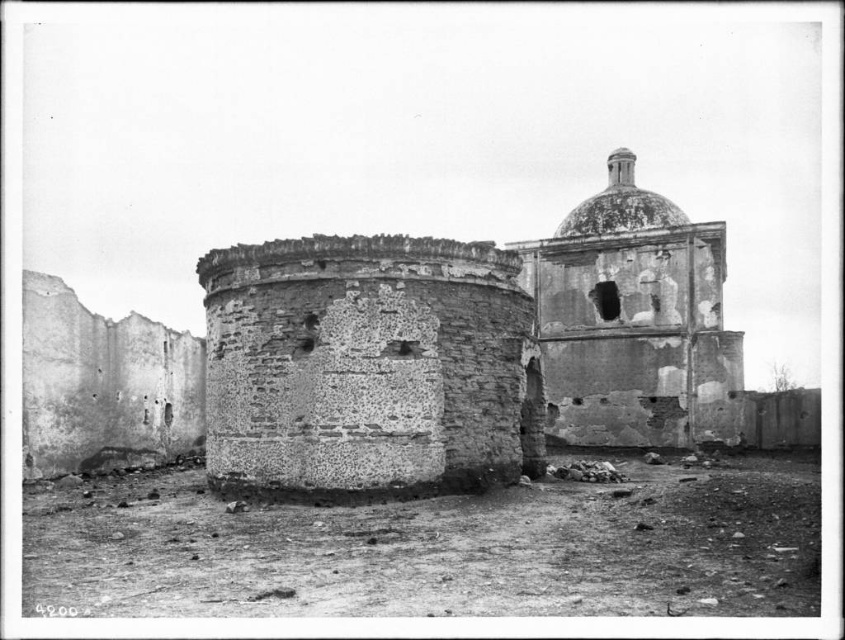
Question: Can you confirm if rough stone wall at center is smaller than smooth concrete dome at upper center?

Choices:
 (A) no
 (B) yes

Answer: (B)

Question: Is rough stone dome at upper right above smooth concrete dome at upper center?

Choices:
 (A) no
 (B) yes

Answer: (A)

Question: Which object is farther from the camera taking this photo?

Choices:
 (A) smooth concrete dome at upper center
 (B) rough stone dome at upper right
 (C) rough stone wall at center

Answer: (A)

Question: Which point is farther to the camera?

Choices:
 (A) rough stone dome at upper right
 (B) rough stone wall at center
 (C) smooth concrete dome at upper center

Answer: (C)

Question: Which point is farther from the camera taking this photo?

Choices:
 (A) (587, 269)
 (B) (666, 221)

Answer: (B)

Question: Does rough stone dome at upper right appear under smooth concrete dome at upper center?

Choices:
 (A) no
 (B) yes

Answer: (B)